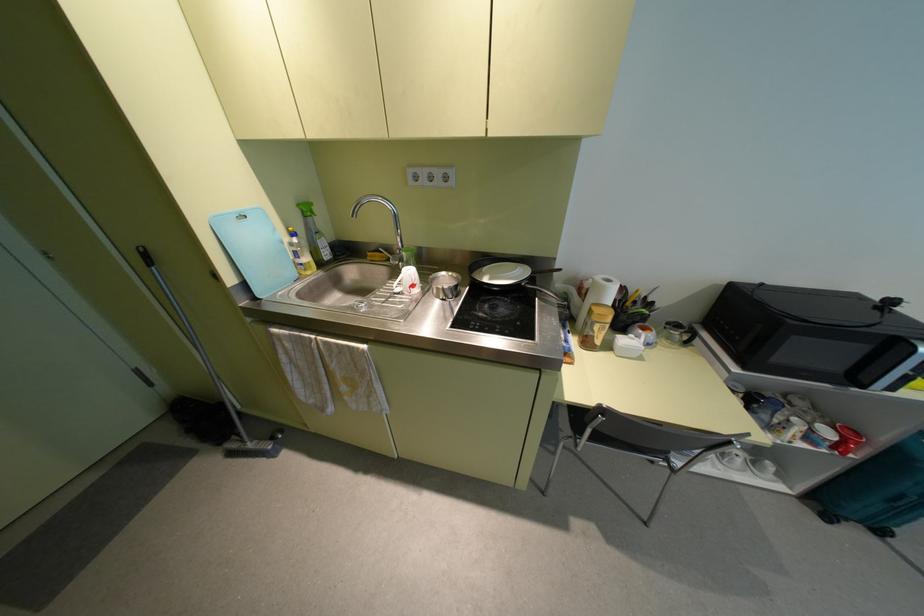
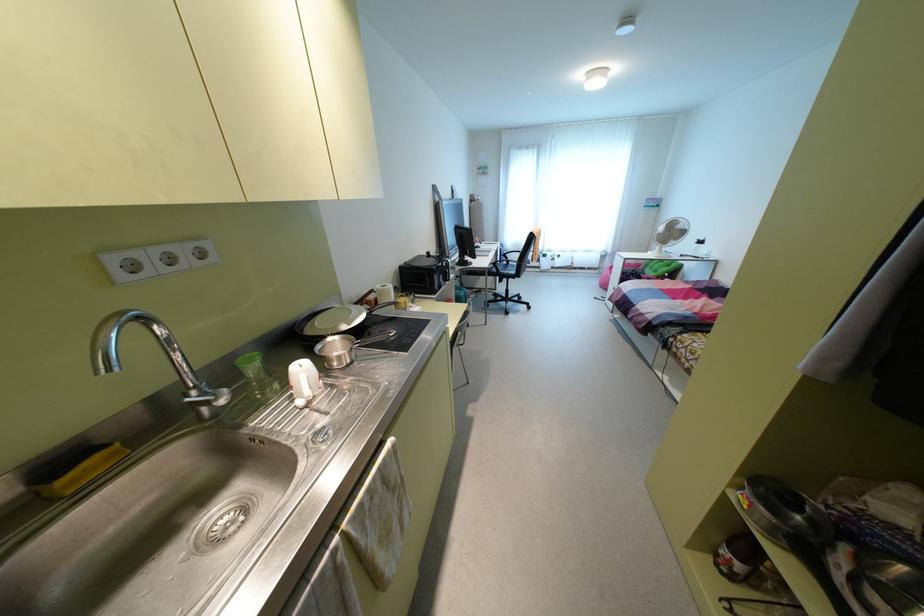
Find the pixel in the second image that matches [436,174] in the first image.

(181, 251)